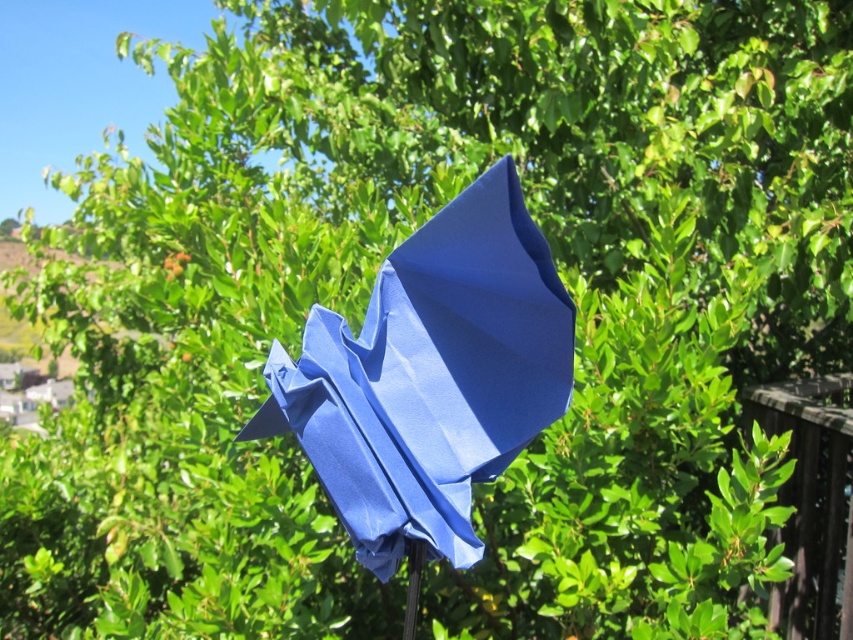
You are standing in a garden and see the brown wooden fence at right and the metallic silver pole at lower center. Which object is closer to you?

The metallic silver pole at lower center is behind the brown wooden fence at right, so the brown wooden fence at right is closer to you.

You are standing in a garden and see the matte blue umbrella at center and the metallic silver pole at lower center. Which object is positioned more to the left side?

The matte blue umbrella at center is positioned more to the left side than the metallic silver pole at lower center.

Consider the image. You are holding a small toy that needs to be placed between the matte blue umbrella at center and the metallic silver pole at lower center. Since the toy is 10 cm tall, will it fit vertically between them?

The matte blue umbrella at center is closer to the viewer than the metallic silver pole at lower center, so the vertical space between them depends on their positions. However, the objects description only provides information about their depth relation, not their vertical height difference. Therefore, we cannot determine if the toy will fit vertically based on the given information.